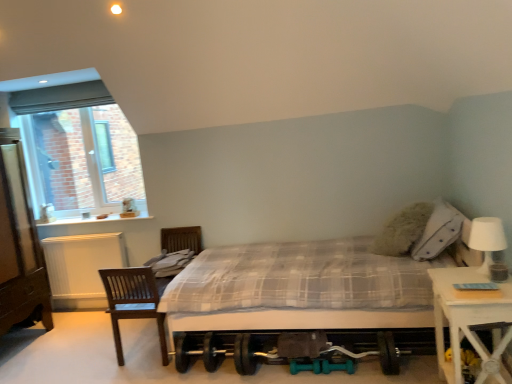
You are a GUI agent. You are given a task and a screenshot of the screen. Output one action in this format:
    pyautogui.click(x=<x>, y=<y>)
    Task: Click on the brown wooden dresser at left
    This screenshot has width=512, height=384.
    Given the screenshot: What is the action you would take?
    pyautogui.click(x=19, y=242)

Locate an element on the screen. plaid fabric bed at center is located at coordinates (269, 321).

This screenshot has height=384, width=512. Describe the element at coordinates (487, 239) in the screenshot. I see `white matte table lamp at right` at that location.

Image resolution: width=512 pixels, height=384 pixels. What do you see at coordinates (469, 320) in the screenshot?
I see `white wood nightstand at right` at bounding box center [469, 320].

Find the location of `brown wooden dresser at left`. brown wooden dresser at left is located at coordinates (19, 242).

Considering the positions of objects white plastic window at upper left and white textured radiator at left in the image provided, who is more to the right, white plastic window at upper left or white textured radiator at left?

From the viewer's perspective, white textured radiator at left appears more on the right side.

In the scene shown: Does white plastic window at upper left turn towards white textured radiator at left?

No, white plastic window at upper left is not oriented towards white textured radiator at left.

Which is nearer, (22,128) or (122,242)?

Point (122,242)

From a real-world perspective, is white plastic window at upper left positioned above or below white textured radiator at left?

From a real-world perspective, white plastic window at upper left is physically above white textured radiator at left.

Does brown wooden dresser at left turn towards white textured radiator at left?

No.

This screenshot has height=384, width=512. Identify the location of radiator behind the brown wooden dresser at left. (82, 264).

From a real-world perspective, is brown wooden dresser at left physically located above or below white textured radiator at left?

In terms of real-world spatial position, brown wooden dresser at left is above white textured radiator at left.

Which is less distant, (3, 221) or (75, 277)?

Point (3, 221) appears to be closer to the viewer than point (75, 277).

From the picture: Is plaid fabric bed at center smaller than white textured radiator at left?

No, plaid fabric bed at center is not smaller than white textured radiator at left.

Which point is more distant from viewer, (x=258, y=326) or (x=62, y=259)?

The point (x=62, y=259) is farther.

Image resolution: width=512 pixels, height=384 pixels. What are the coordinates of `bed located in front of the white textured radiator at left` in the screenshot? It's located at (269, 321).

Can white textured radiator at left be found inside plaid fabric bed at center?

Definitely not — white textured radiator at left is not inside plaid fabric bed at center.

Which point is more forward, (78, 286) or (474, 346)?

The point (474, 346) is closer to the camera.

Would you say white textured radiator at left is to the left or to the right of white wood nightstand at right in the picture?

white textured radiator at left is to the left of white wood nightstand at right.

Who is shorter, white textured radiator at left or white wood nightstand at right?

white wood nightstand at right.

In the scene shown: Is white textured radiator at left wider or thinner than white wood nightstand at right?

In the image, white textured radiator at left appears to be more narrow than white wood nightstand at right.

From the image's perspective, relative to white wood nightstand at right, is white matte table lamp at right above or below?

From the image's perspective, white matte table lamp at right appears above white wood nightstand at right.

Locate an element on the screen. table lamp behind the white wood nightstand at right is located at coordinates (487, 239).

Which is closer to the camera, (487, 237) or (469, 299)?

Positioned in front is point (469, 299).

From a real-world perspective, who is located higher, white matte table lamp at right or white wood nightstand at right?

white matte table lamp at right.

This screenshot has width=512, height=384. I want to click on window behind the white wood nightstand at right, so tap(78, 149).

Does white wood nightstand at right have a greater height compared to white plastic window at upper left?

No.

Is there a large distance between white wood nightstand at right and white plastic window at upper left?

Absolutely, white wood nightstand at right is distant from white plastic window at upper left.

How different are the orientations of white wood nightstand at right and white plastic window at upper left in degrees?

The angular difference between white wood nightstand at right and white plastic window at upper left is 92.2 degrees.

How different are the orientations of white textured radiator at left and plaid fabric bed at center in degrees?

They differ by 91.5 degrees in their facing directions.

Is white textured radiator at left positioned with its back to plaid fabric bed at center?

white textured radiator at left is not turned away from plaid fabric bed at center.

Which is correct: white textured radiator at left is inside plaid fabric bed at center, or outside of it?

The correct answer is: outside.

Based on the photo, can you confirm if white textured radiator at left is taller than plaid fabric bed at center?

Incorrect, the height of white textured radiator at left is not larger of that of plaid fabric bed at center.

You are a GUI agent. You are given a task and a screenshot of the screen. Output one action in this format:
    pyautogui.click(x=<x>, y=<y>)
    Task: Click on the radiator that is under the white plastic window at upper left (from a real-world perspective)
    This screenshot has height=384, width=512.
    Given the screenshot: What is the action you would take?
    pyautogui.click(x=82, y=264)

At what (x,y) coordinates should I click in order to perform the action: click on dresser located on the left of white textured radiator at left. Please return your answer as a coordinate pair (x, y). Image resolution: width=512 pixels, height=384 pixels. Looking at the image, I should click on (19, 242).

From the image, which object appears to be nearer to white wood nightstand at right, brown wooden dresser at left or plaid fabric bed at center?

The object closer to white wood nightstand at right is plaid fabric bed at center.

From the image, which object appears to be farther from plaid fabric bed at center, white wood nightstand at right or white matte table lamp at right?

white matte table lamp at right.

Estimate the real-world distances between objects in this image. Which object is closer to white plastic window at upper left, white wood nightstand at right or white matte table lamp at right?

A: white wood nightstand at right lies closer to white plastic window at upper left than the other object.

Considering their positions, is plaid fabric bed at center positioned further to brown wooden dresser at left than white plastic window at upper left?

The object further to brown wooden dresser at left is plaid fabric bed at center.

Which object lies further to the anchor point white wood nightstand at right, plaid fabric bed at center or white plastic window at upper left?

Based on the image, white plastic window at upper left appears to be further to white wood nightstand at right.

Based on their spatial positions, is white plastic window at upper left or plaid fabric bed at center further from white matte table lamp at right?

white plastic window at upper left is positioned further to the anchor white matte table lamp at right.

When comparing their distances from plaid fabric bed at center, does white wood nightstand at right or brown wooden dresser at left seem further?

Based on the image, brown wooden dresser at left appears to be further to plaid fabric bed at center.

Looking at the image, which one is located further to brown wooden dresser at left, white textured radiator at left or white matte table lamp at right?

The object further to brown wooden dresser at left is white matte table lamp at right.

You are a GUI agent. You are given a task and a screenshot of the screen. Output one action in this format:
    pyautogui.click(x=<x>, y=<y>)
    Task: Click on the bed between white plastic window at upper left and white matte table lamp at right in the horizontal direction
    The height and width of the screenshot is (384, 512).
    Given the screenshot: What is the action you would take?
    pyautogui.click(x=269, y=321)

Locate an element on the screen. bed between white plastic window at upper left and white wood nightstand at right from left to right is located at coordinates (269, 321).

Where is `radiator between brown wooden dresser at left and white matte table lamp at right from left to right`? radiator between brown wooden dresser at left and white matte table lamp at right from left to right is located at coordinates (82, 264).

Locate an element on the screen. radiator between white plastic window at upper left and white wood nightstand at right is located at coordinates (82, 264).